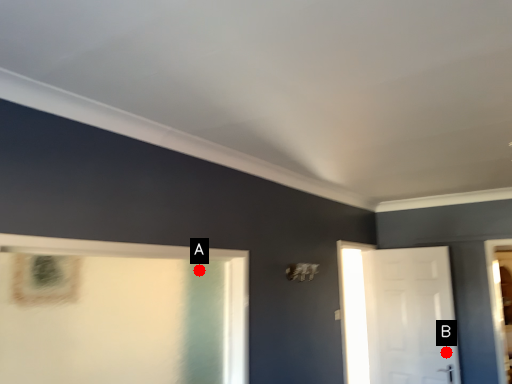
Question: Two points are circled on the image, labeled by A and B beside each circle. Which of the following is the farthest from the observer?

Choices:
 (A) A is further
 (B) B is further

Answer: (A)